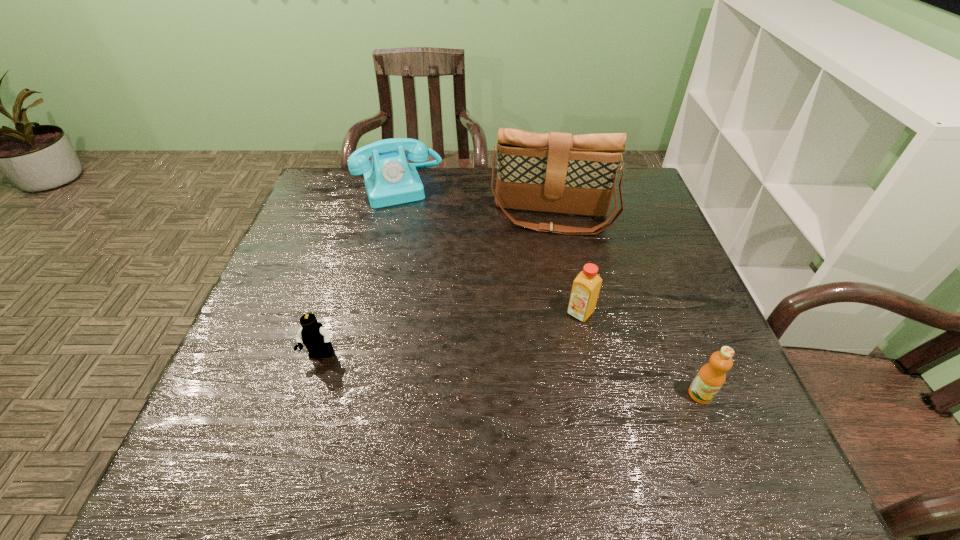
Find the location of a particular element. The image size is (960, 540). object located in the near edge section of the desktop is located at coordinates pos(711,376).

Locate an element on the screen. The width and height of the screenshot is (960, 540). Lego located at the left edge is located at coordinates (316, 338).

You are a GUI agent. You are given a task and a screenshot of the screen. Output one action in this format:
    pyautogui.click(x=<x>, y=<y>)
    Task: Click on the telephone positioned at the left edge
    The width and height of the screenshot is (960, 540).
    Given the screenshot: What is the action you would take?
    pyautogui.click(x=389, y=180)

Locate an element on the screen. orange juice at the right edge is located at coordinates (711, 376).

Image resolution: width=960 pixels, height=540 pixels. Find the location of `shoulder bag that is at the right edge`. shoulder bag that is at the right edge is located at coordinates (555, 172).

You are a GUI agent. You are given a task and a screenshot of the screen. Output one action in this format:
    pyautogui.click(x=<x>, y=<y>)
    Task: Click on the object at the far left corner
    The width and height of the screenshot is (960, 540).
    Given the screenshot: What is the action you would take?
    pyautogui.click(x=389, y=180)

This screenshot has height=540, width=960. I want to click on object that is at the far right corner, so click(x=555, y=172).

Find the location of a particular element. The height and width of the screenshot is (540, 960). object that is positioned at the near right corner is located at coordinates (711, 376).

Identify the location of vacant space at the far edge. The height and width of the screenshot is (540, 960). (466, 188).

This screenshot has width=960, height=540. In the image, there is a desktop. Find the location of `vacant space at the near edge`. vacant space at the near edge is located at coordinates (519, 421).